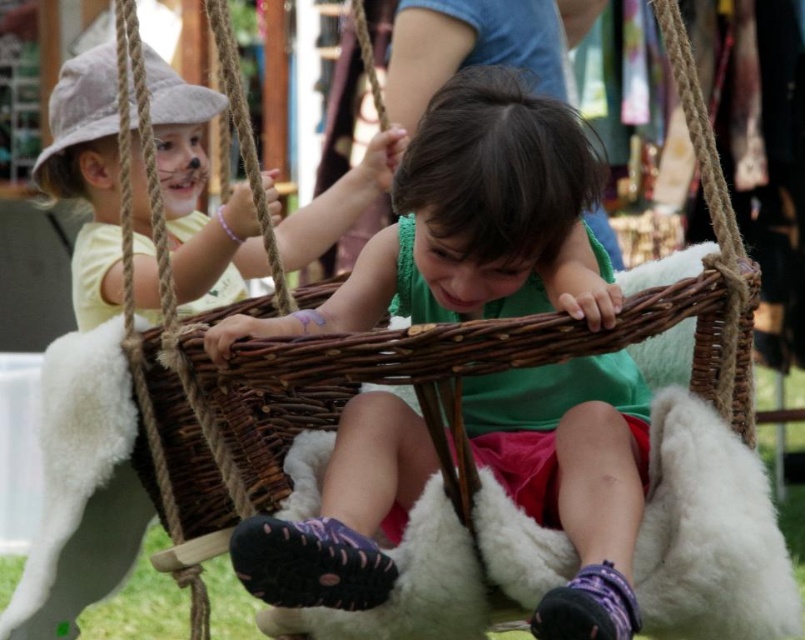
Question: Does white fluffy cushion at center appear under matte yellow shirt at left?

Choices:
 (A) yes
 (B) no

Answer: (A)

Question: Which point is closer to the camera?

Choices:
 (A) matte wicker basket at center
 (B) white fluffy cushion at center
 (C) matte yellow shirt at left

Answer: (A)

Question: Which point is farther to the camera?

Choices:
 (A) matte yellow shirt at left
 (B) matte wicker basket at center

Answer: (A)

Question: Which of the following is the farthest from the observer?

Choices:
 (A) matte yellow shirt at left
 (B) white fluffy cushion at center
 (C) matte wicker basket at center

Answer: (A)

Question: Is matte wicker basket at center further to the viewer compared to white fluffy cushion at center?

Choices:
 (A) yes
 (B) no

Answer: (B)

Question: Is matte wicker basket at center thinner than matte yellow shirt at left?

Choices:
 (A) no
 (B) yes

Answer: (B)